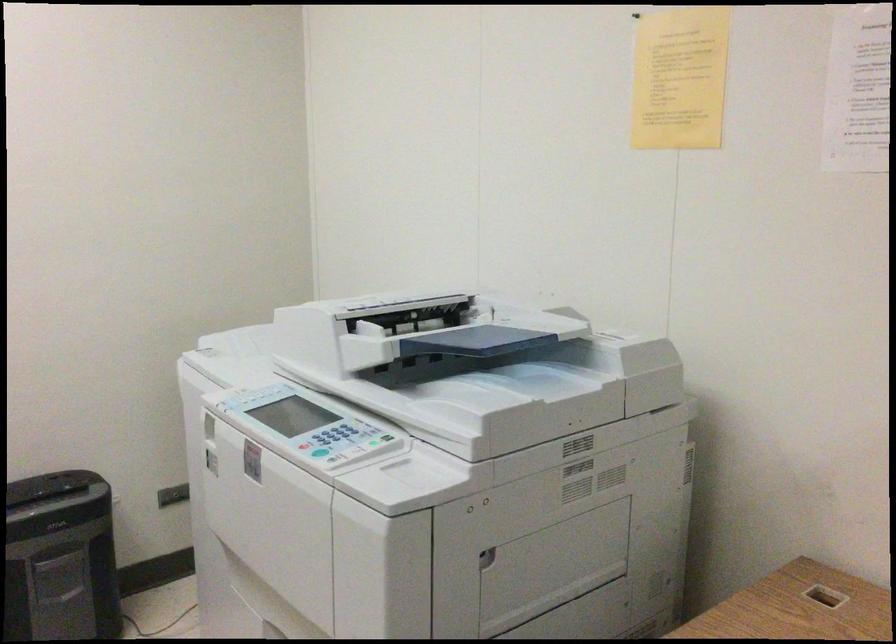
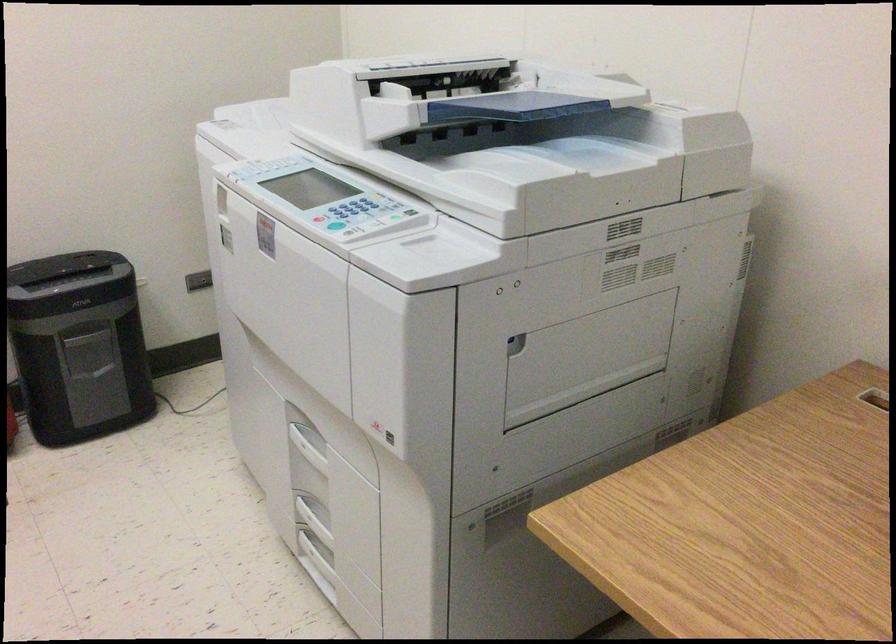
Find the pixel in the second image that matches the point at 280,570 in the first image.

(296, 350)